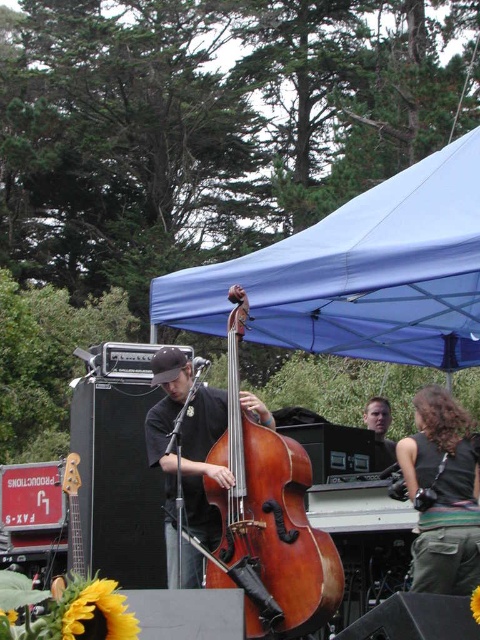
Question: Can you confirm if brown wooden bass at center is wider than matte black guitar at center?

Choices:
 (A) yes
 (B) no

Answer: (A)

Question: Considering the real-world distances, which object is closest to the shiny brown wood cello at center?

Choices:
 (A) matte black guitar at center
 (B) dark brown leather jacket at lower right
 (C) brown wooden bass at center

Answer: (C)

Question: Can you confirm if shiny brown wood cello at center is thinner than dark brown leather jacket at lower right?

Choices:
 (A) yes
 (B) no

Answer: (B)

Question: Which of the following is the closest to the observer?

Choices:
 (A) dark brown leather jacket at lower right
 (B) blue fabric canopy at upper center
 (C) shiny brown wood cello at center

Answer: (C)

Question: Which is nearer to the shiny brown wood cello at center?

Choices:
 (A) blue fabric canopy at upper center
 (B) dark brown leather jacket at lower right
 (C) matte black guitar at center
 (D) brown wooden bass at center

Answer: (D)

Question: Considering the relative positions of blue fabric canopy at upper center and shiny brown wood cello at center in the image provided, where is blue fabric canopy at upper center located with respect to shiny brown wood cello at center?

Choices:
 (A) above
 (B) below

Answer: (A)